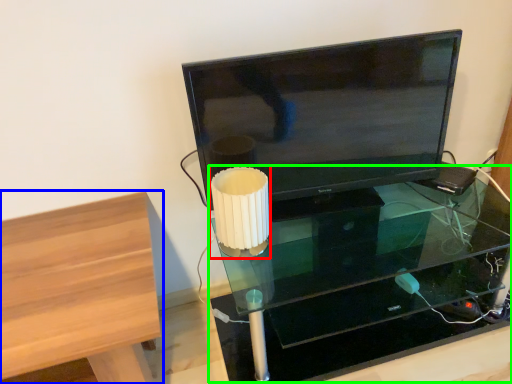
Question: Which object is the closest to the table lamp (highlighted by a red box)? Choose among these: furniture (highlighted by a blue box) or table (highlighted by a green box).

Choices:
 (A) furniture
 (B) table

Answer: (A)